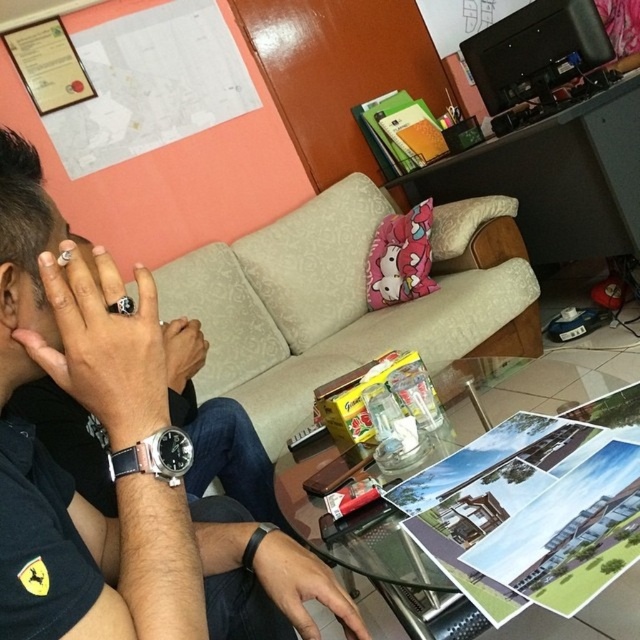
Consider the image. Measure the distance between black leather watch at center and camera.

They are 16.01 inches apart.

This screenshot has height=640, width=640. What do you see at coordinates (122, 476) in the screenshot?
I see `black leather watch at center` at bounding box center [122, 476].

Where is `black leather watch at center`? The width and height of the screenshot is (640, 640). black leather watch at center is located at coordinates (122, 476).

How far apart are silver metallic ring at center and black leather watch at lower left?

silver metallic ring at center is 3.45 inches away from black leather watch at lower left.

Which is more to the left, silver metallic ring at center or black leather watch at lower left?

From the viewer's perspective, silver metallic ring at center appears more on the left side.

Is point (131, 371) positioned before point (182, 470)?

Yes.

The height and width of the screenshot is (640, 640). Find the location of `silver metallic ring at center`. silver metallic ring at center is located at coordinates (104, 344).

Is transparent glass table at center closer to camera compared to black leather ring at center?

Yes, transparent glass table at center is closer to the viewer.

Who is more forward, (x=291, y=499) or (x=173, y=326)?

Positioned in front is point (x=173, y=326).

Image resolution: width=640 pixels, height=640 pixels. I want to click on transparent glass table at center, so click(x=355, y=536).